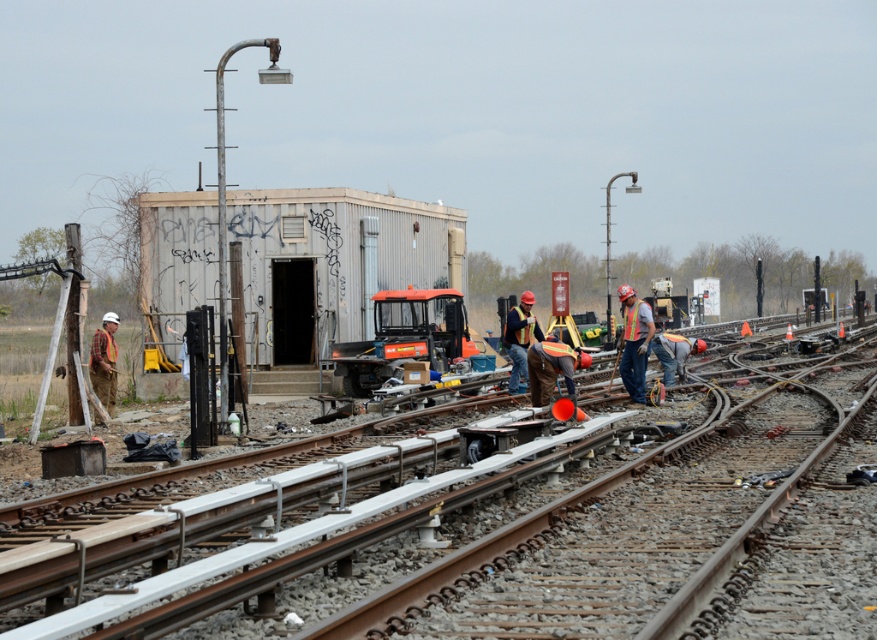
Question: Is the position of orange plastic tractor at center less distant than that of reflective orange safety vest at center?

Choices:
 (A) no
 (B) yes

Answer: (A)

Question: In this image, where is orange plastic tractor at center located relative to reflective orange safety vest at center?

Choices:
 (A) above
 (B) below

Answer: (B)

Question: From the image, what is the correct spatial relationship of orange plastic tractor at center in relation to reflective orange safety vest at center?

Choices:
 (A) right
 (B) left

Answer: (B)